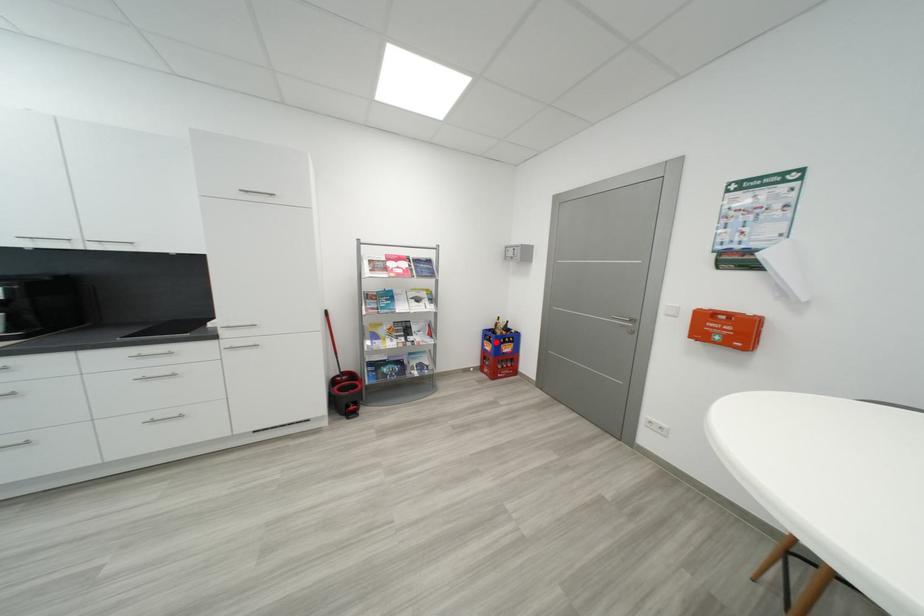
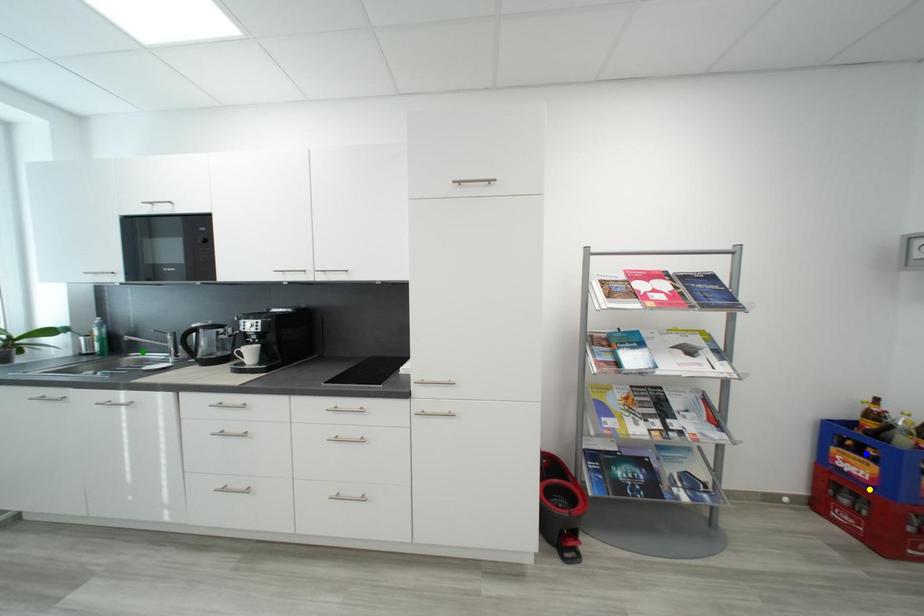
Question: I am providing you with two images of the same scene from different viewpoints. A red point is marked on the first image. You are given multiple points on the second image. Which point in image 2 is actually the same real-world point as the red point in image 1?

Choices:
 (A) green point
 (B) yellow point
 (C) blue point

Answer: (C)